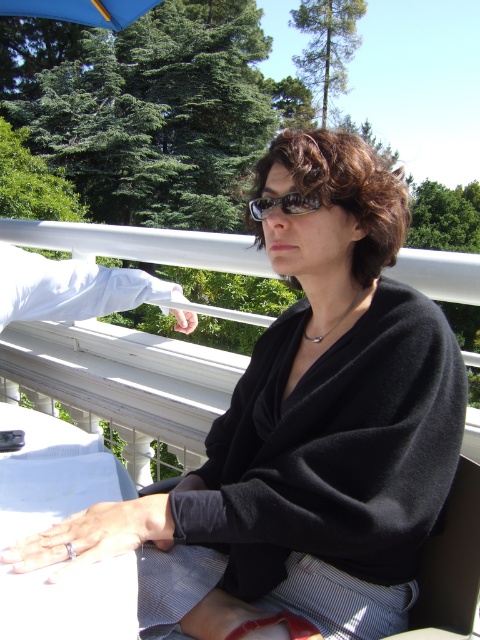
You are standing at the center of the image. Which object is located at the coordinates point (49, 472)?

The white glossy table at lower left is located at point (49, 472).

You are standing in front of the table covered with a white cloth on the balcony. You want to place a 100 cm long object on the table. Can you determine if the table has enough space along the direction from the edge closest to you to the point at coordinate point (12, 509)?

The distance from the viewer to the point (12, 509) is 97.36 centimeters. Since the object is 100 cm long, the table does not have enough space along that direction as the available space is shorter than the object.

You are a delivery person holding a package that is 12 inches wide. You need to place it on the white glossy table at lower left. Can you fit the package on the table without it hanging off the edge?

The white glossy table at lower left and viewer are 26.43 inches apart from each other. Since the package is only 12 inches wide, it will fit on the table as long as the table is at least 12 inches wide. However, the exact width of the table isn